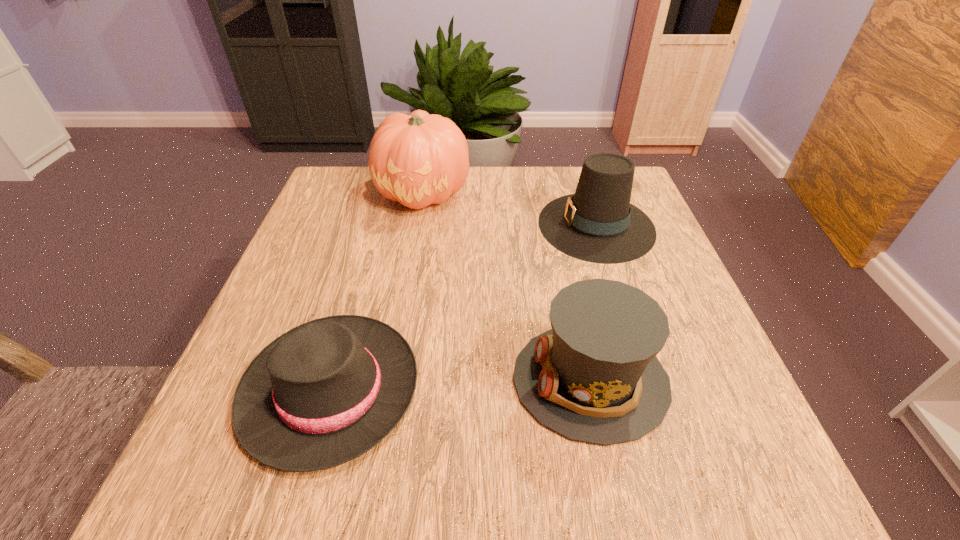
Find the location of a particular element. The image size is (960, 540). free space at the far left corner is located at coordinates (340, 192).

What are the coordinates of `free space at the far right corner of the desktop` in the screenshot? It's located at (635, 192).

Find the location of `free space at the near right corner of the desktop`. free space at the near right corner of the desktop is located at coordinates (x=704, y=443).

Locate an element on the screen. The height and width of the screenshot is (540, 960). blank region between the farthest dress hat and the shortest dress hat is located at coordinates (464, 307).

The image size is (960, 540). Find the location of `vacant space that's between the farthest dress hat and the pumpkin`. vacant space that's between the farthest dress hat and the pumpkin is located at coordinates (510, 208).

This screenshot has width=960, height=540. In order to click on free area in between the farthest dress hat and the leftmost dress hat in this screenshot , I will do `click(464, 307)`.

At what (x,y) coordinates should I click in order to perform the action: click on free area in between the shortest dress hat and the pumpkin. Please return your answer as a coordinate pair (x, y). This screenshot has height=540, width=960. Looking at the image, I should click on (377, 291).

Locate an element on the screen. object that is the third closest to the pumpkin is located at coordinates (594, 377).

Identify the location of object that stands as the third closest to the pumpkin. (594, 377).

Locate which dress hat is the closest to the tallest object. Please provide its 2D coordinates. Your answer should be formatted as a tuple, i.e. [(x, y)], where the tuple contains the x and y coordinates of a point satisfying the conditions above.

[(598, 224)]